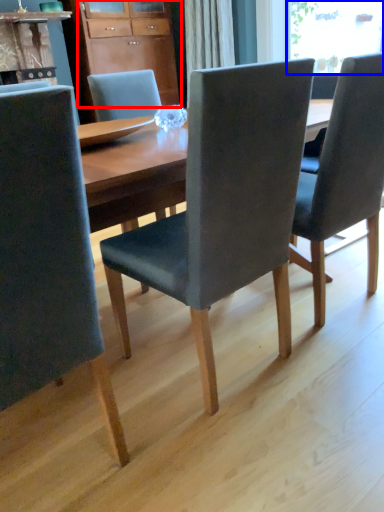
Question: Which point is closer to the camera, cabinetry (highlighted by a red box) or window screen (highlighted by a blue box)?

Choices:
 (A) cabinetry
 (B) window screen

Answer: (B)